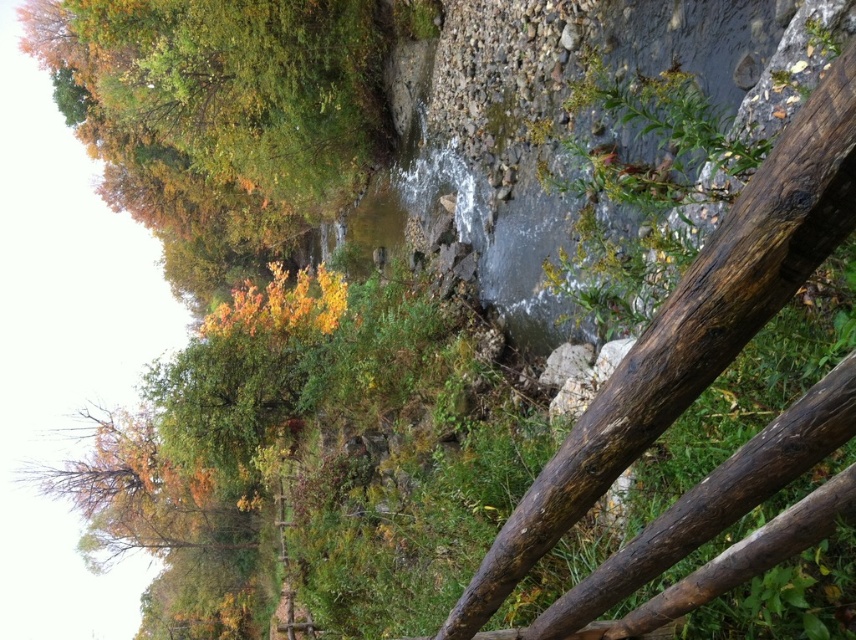
The width and height of the screenshot is (856, 640). What do you see at coordinates (224, 113) in the screenshot?
I see `autumn leaves at upper left` at bounding box center [224, 113].

Between point (342, 97) and point (723, 259), which one is positioned in front?

Point (723, 259) is more forward.

Who is more forward, (x=182, y=284) or (x=498, y=538)?

Point (x=498, y=538) is in front.

The height and width of the screenshot is (640, 856). What are the coordinates of `autumn leaves at upper left` in the screenshot? It's located at (224, 113).